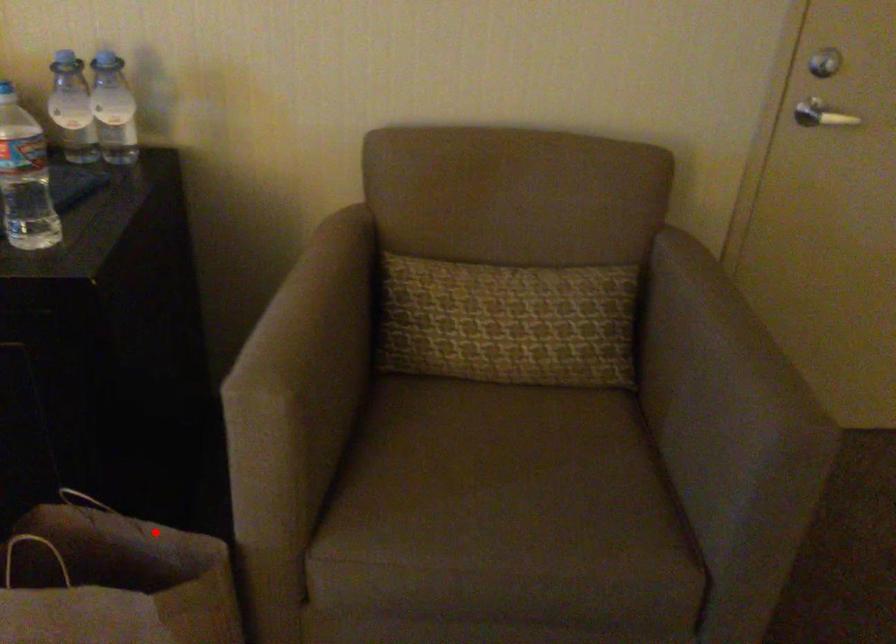
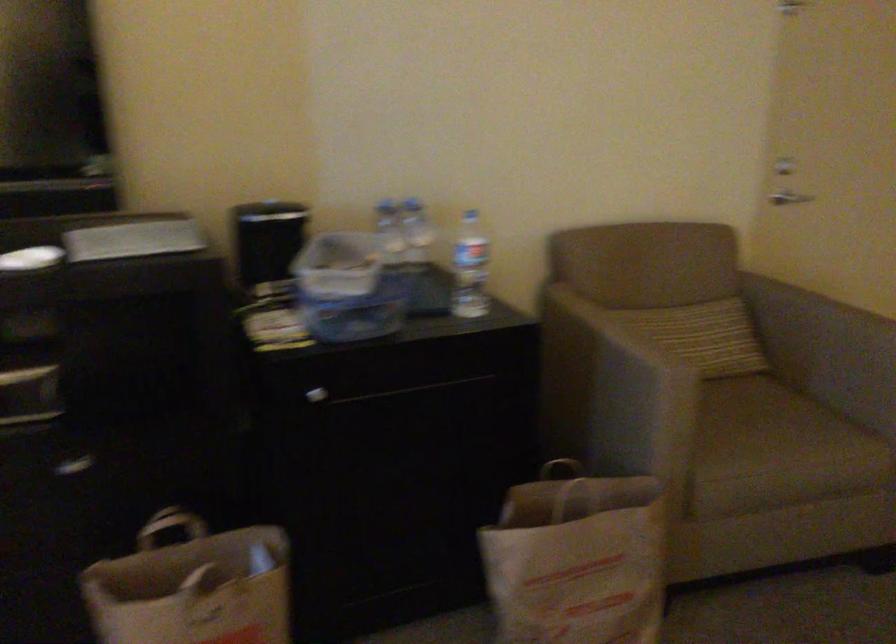
Question: I am providing you with two images of the same scene from different viewpoints. Image1 has a red point marked. In image2, the corresponding 3D location appears at what relative position? Reply with the corresponding letter.

Choices:
 (A) Closer
 (B) Farther

Answer: (B)